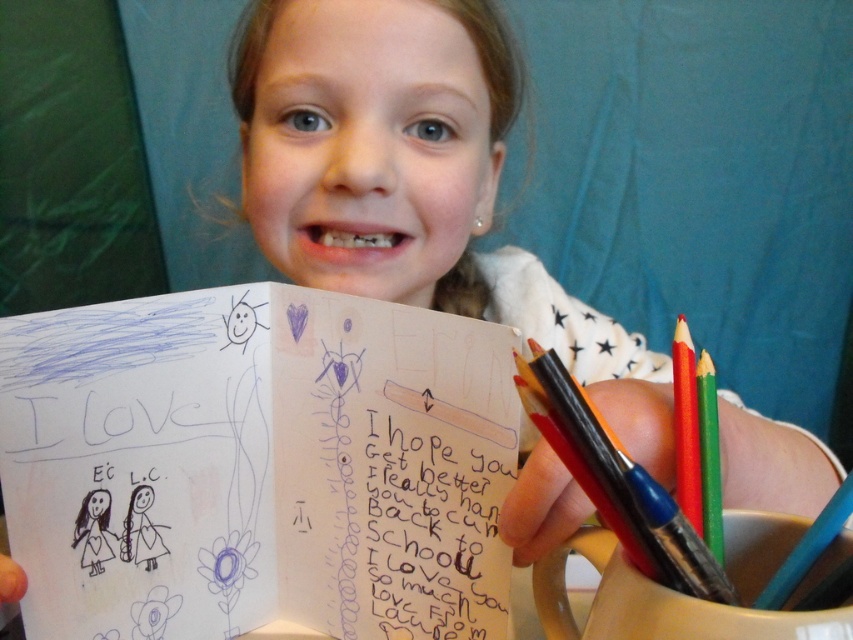
Which of these two, matte black pencil at right or red matte pencil at right, stands taller?

With more height is red matte pencil at right.

Between point (550, 442) and point (682, 364), which one is positioned behind?

The point (682, 364) is more distant.

Locate an element on the screen. The height and width of the screenshot is (640, 853). matte black pencil at right is located at coordinates (618, 483).

In the scene shown: Does matte black pencil at right have a greater height compared to green matte crayon at right?

Incorrect, matte black pencil at right's height is not larger of green matte crayon at right's.

Image resolution: width=853 pixels, height=640 pixels. What do you see at coordinates (618, 483) in the screenshot?
I see `matte black pencil at right` at bounding box center [618, 483].

I want to click on matte black pencil at right, so click(618, 483).

Is white paper notebook at center to the left of green matte crayon at right from the viewer's perspective?

Indeed, white paper notebook at center is positioned on the left side of green matte crayon at right.

Does white paper notebook at center appear on the right side of green matte crayon at right?

In fact, white paper notebook at center is to the left of green matte crayon at right.

Who is more forward, (431, 412) or (714, 481)?

Positioned in front is point (714, 481).

Image resolution: width=853 pixels, height=640 pixels. Identify the location of white paper notebook at center. (257, 465).